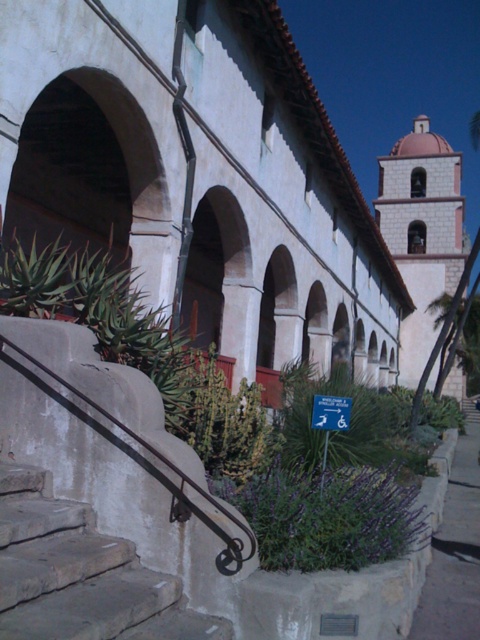
You are standing at the base of the stone steps in front of the historic building. You notice two points marked on the image, point 1 at coordinates (x=180, y=58) and point 2 at coordinates (x=224, y=550). Which point is closer to you?

Point 1 at coordinates (x=180, y=58) is closer to you because it is further to the viewer than point 2 at coordinates (x=224, y=550).

You are standing at the base of the stone steps in the image. You want to walk towards the entrance of the white stucco church at center. Which direction should you move relative to the rusty metal handrail at lower left?

The white stucco church at center is to the right of the rusty metal handrail at lower left, so you should move to the right of the rusty metal handrail at lower left to reach the entrance.